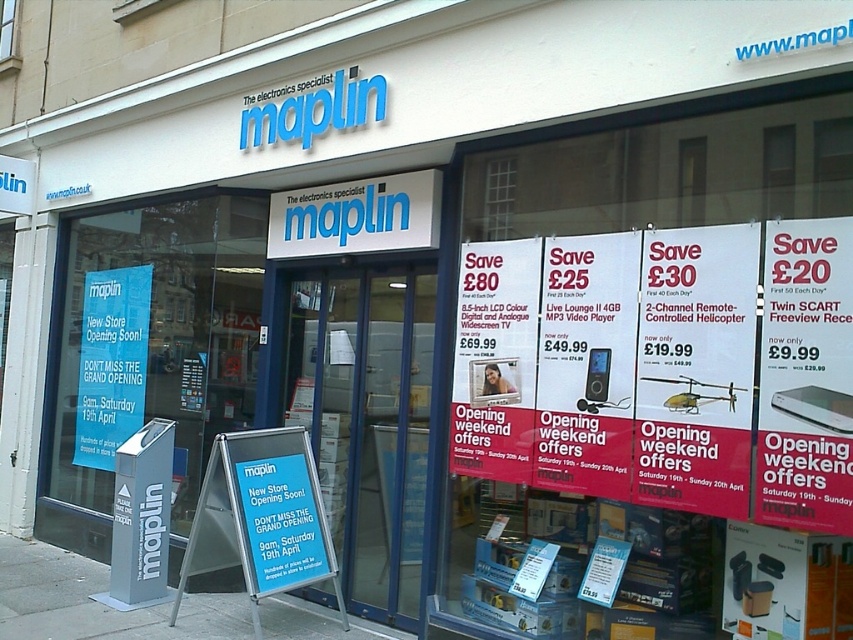
Which is in front, point (170, 221) or point (502, 394)?

Point (502, 394) is in front.

This screenshot has height=640, width=853. Describe the element at coordinates (155, 339) in the screenshot. I see `blue paper at left` at that location.

Find the location of a particular element. This screenshot has width=853, height=640. blue paper at left is located at coordinates (155, 339).

The width and height of the screenshot is (853, 640). What do you see at coordinates (495, 360) in the screenshot? I see `matte white poster at center` at bounding box center [495, 360].

Find the location of a particular element. The width and height of the screenshot is (853, 640). matte white poster at center is located at coordinates (495, 360).

This screenshot has height=640, width=853. Identify the location of matte white poster at center. (495, 360).

Is blue paper at left wider than blue plastic sign at center?

Indeed, blue paper at left has a greater width compared to blue plastic sign at center.

Based on the photo, who is positioned more to the left, blue paper at left or blue plastic sign at center?

From the viewer's perspective, blue paper at left appears more on the left side.

Is point (173, 452) less distant than point (389, 202)?

No, it is behind (389, 202).

Locate an element on the screen. The width and height of the screenshot is (853, 640). blue paper at left is located at coordinates [155, 339].